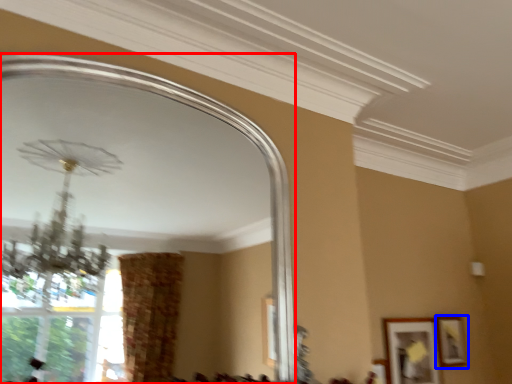
Question: Which object is further to the camera taking this photo, mirror (highlighted by a red box) or picture frame (highlighted by a blue box)?

Choices:
 (A) mirror
 (B) picture frame

Answer: (B)